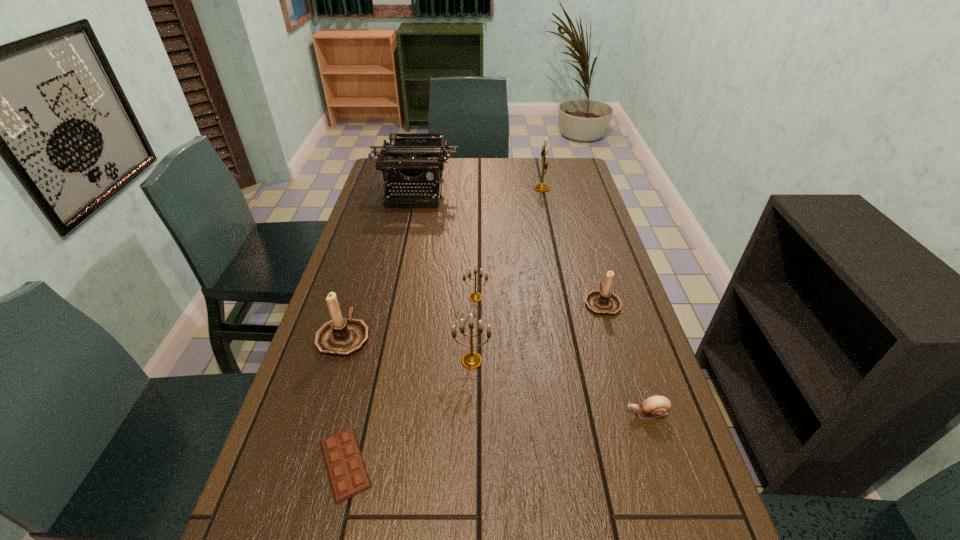
The width and height of the screenshot is (960, 540). What are the coordinates of `object that is at the far right corner` in the screenshot? It's located at (540, 187).

Identify the location of free space at the far edge of the desktop. (498, 167).

In the image, there is a desktop. Where is `vacant space at the left edge`? This screenshot has height=540, width=960. vacant space at the left edge is located at coordinates point(384,298).

In the image, there is a desktop. At what (x,y) coordinates should I click in order to perform the action: click on vacant space at the right edge. Please return your answer as a coordinate pair (x, y). The width and height of the screenshot is (960, 540). Looking at the image, I should click on (646, 478).

Where is `vacant area that lies between the second nearest gold candelabrum and the left brown candle holder`? vacant area that lies between the second nearest gold candelabrum and the left brown candle holder is located at coordinates (410, 316).

Identify the location of vacant space in between the smallest gold candelabrum and the typewriter. This screenshot has height=540, width=960. (445, 245).

Where is `free space that is in between the nearest object and the seventh farthest object`? free space that is in between the nearest object and the seventh farthest object is located at coordinates (496, 438).

At what (x,y) coordinates should I click in order to perform the action: click on empty space between the shortest object and the typewriter. Please return your answer as a coordinate pair (x, y). Looking at the image, I should click on (380, 328).

Locate an element on the screen. free spot between the nearest gold candelabrum and the second nearest object is located at coordinates (560, 387).

This screenshot has width=960, height=540. I want to click on vacant area that lies between the typewriter and the bigger brown candle holder, so click(379, 264).